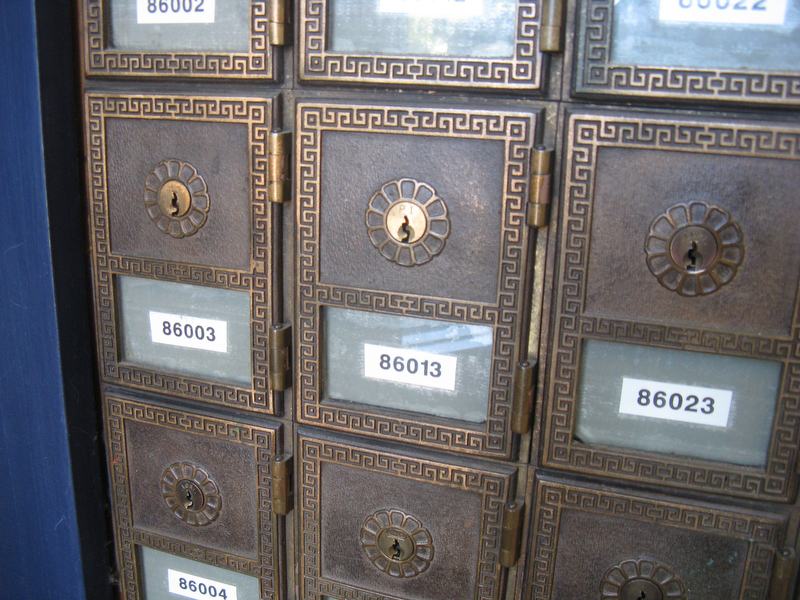
You are a GUI agent. You are given a task and a screenshot of the screen. Output one action in this format:
    pyautogui.click(x=<x>, y=<y>)
    Task: Click on the hinge
    The height and width of the screenshot is (600, 800).
    Given the screenshot: What is the action you would take?
    pyautogui.click(x=284, y=499), pyautogui.click(x=274, y=356), pyautogui.click(x=524, y=391), pyautogui.click(x=536, y=215), pyautogui.click(x=516, y=535), pyautogui.click(x=784, y=560), pyautogui.click(x=281, y=179), pyautogui.click(x=274, y=20), pyautogui.click(x=545, y=30)